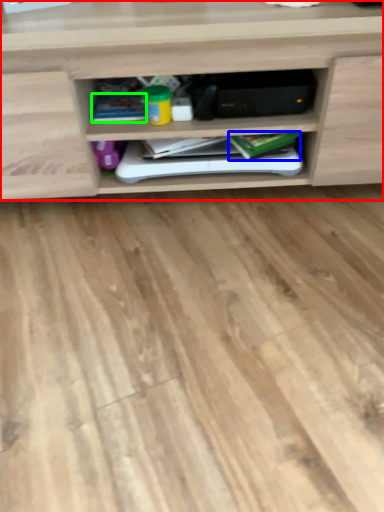
Question: Considering the real-world distances, which object is closest to shelf (highlighted by a red box)? book (highlighted by a blue box) or book (highlighted by a green box).

Choices:
 (A) book
 (B) book

Answer: (B)